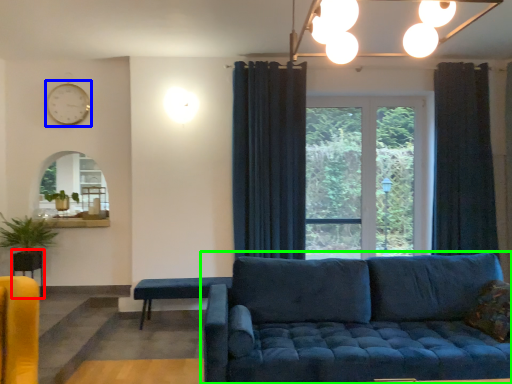
Question: Which object is positioned farthest from table (highlighted by a red box)? Select from clock (highlighted by a blue box) and studio couch (highlighted by a green box).

Choices:
 (A) clock
 (B) studio couch

Answer: (B)